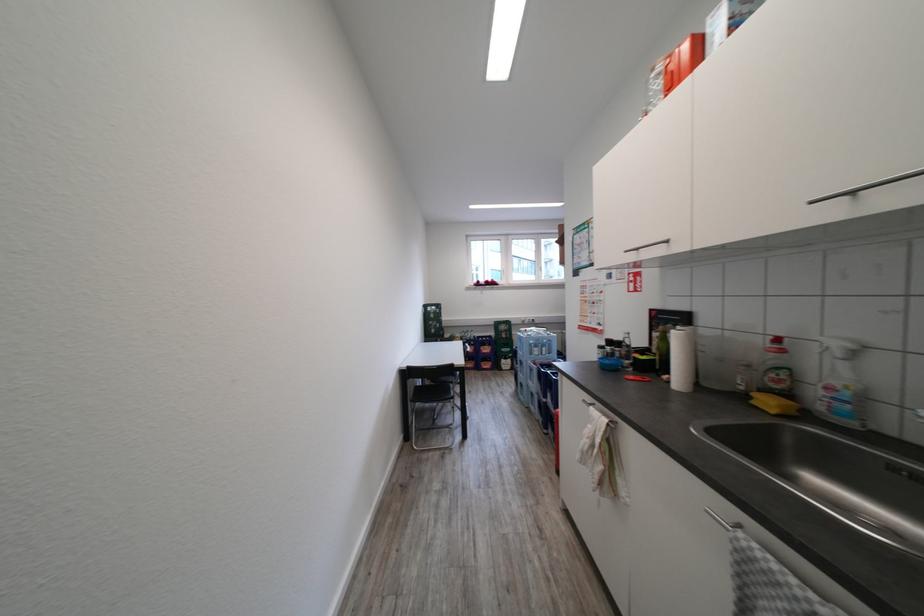
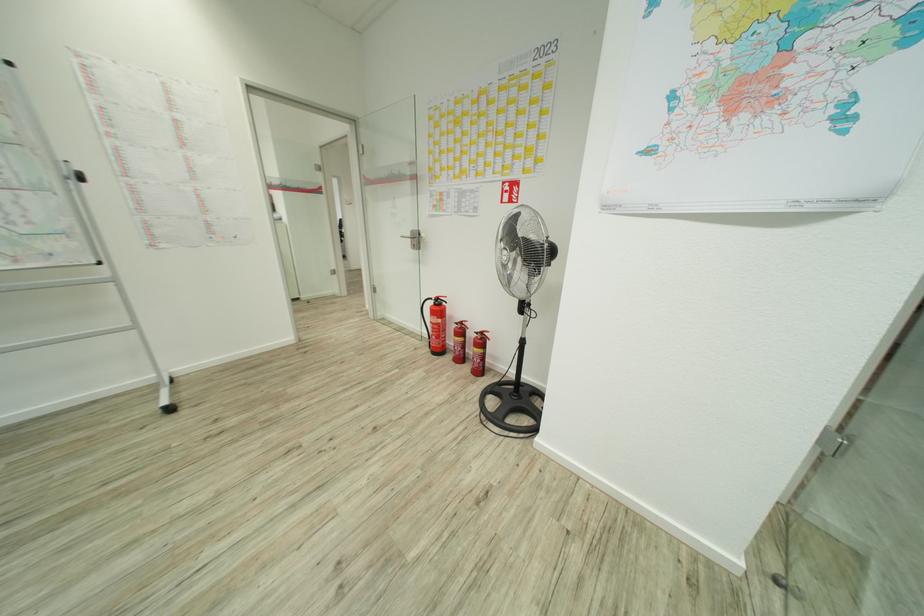
Question: I am providing you with two images of the same scene from different viewpoints. After the viewpoint changes to image2, which objects are now occluded?

Choices:
 (A) grey computer keyboard
 (B) fire extinguisher handle
 (C) chair sitting surface
 (D) silver door handle

Answer: (C)